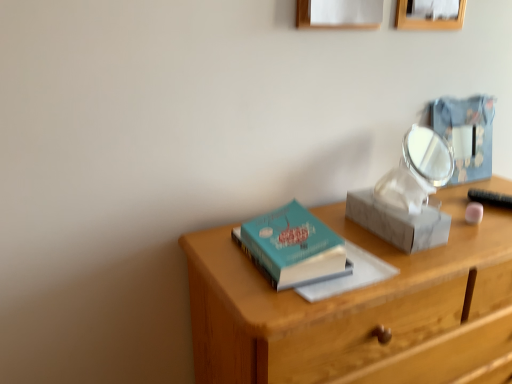
The width and height of the screenshot is (512, 384). I want to click on vacant position to the left of teal matte hardcover book at center, so click(x=219, y=253).